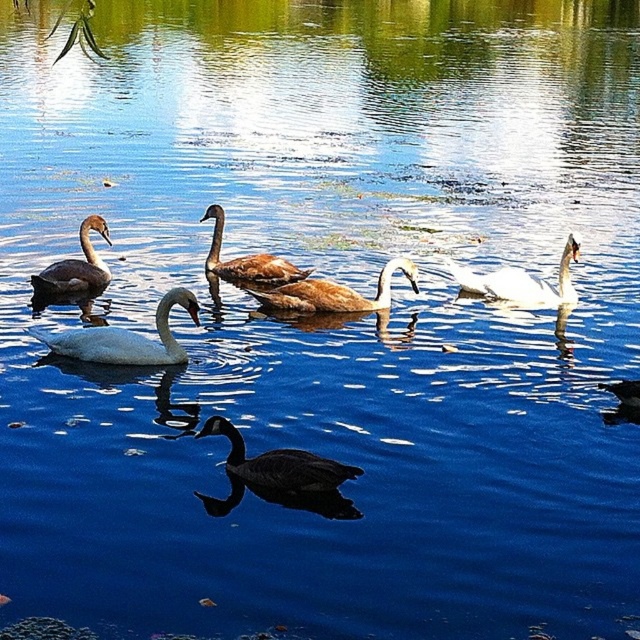
Does white glossy swan at center have a larger size compared to dark gray matte duck at center?

Yes, white glossy swan at center is bigger than dark gray matte duck at center.

Does white glossy swan at center have a greater height compared to dark gray matte duck at center?

Yes, white glossy swan at center is taller than dark gray matte duck at center.

Is point (118, 340) in front of point (321, 472)?

No.

The width and height of the screenshot is (640, 640). I want to click on white glossy swan at center, so click(x=125, y=337).

Between white glossy swan at center and brown feathered swan at center, which one appears on the left side from the viewer's perspective?

white glossy swan at center is more to the left.

Does point (44, 336) come in front of point (220, 243)?

Yes, point (44, 336) is closer to viewer.

What do you see at coordinates (125, 337) in the screenshot? I see `white glossy swan at center` at bounding box center [125, 337].

Find the location of a particular element. white glossy swan at center is located at coordinates (125, 337).

The image size is (640, 640). Describe the element at coordinates (125, 337) in the screenshot. I see `white glossy swan at center` at that location.

Which is above, white glossy swan at center or brown matte swan at left?

brown matte swan at left is above.

Between point (92, 353) and point (48, 291), which one is positioned behind?

The point (48, 291) is behind.

The width and height of the screenshot is (640, 640). I want to click on white glossy swan at center, so click(x=125, y=337).